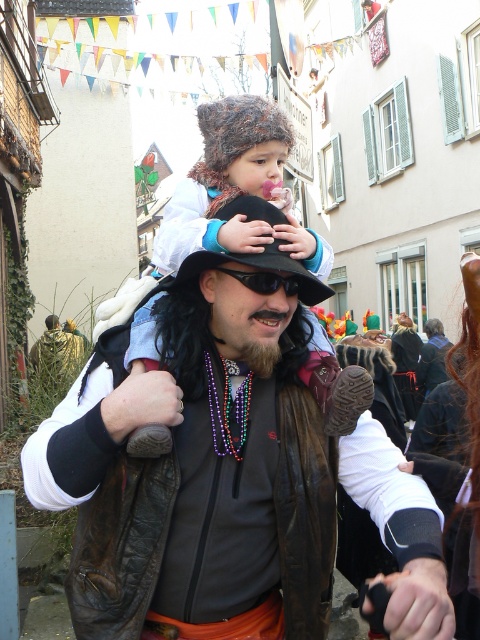
Question: Can you confirm if brown leather jacket at center is wider than black plastic goggles at center?

Choices:
 (A) no
 (B) yes

Answer: (B)

Question: Which point is farther to the camera?

Choices:
 (A) (216, 212)
 (B) (255, 547)
 (C) (203, 115)
 (D) (259, 292)

Answer: (C)

Question: Does fluffy brown hat at center appear on the right side of black felt hat at center?

Choices:
 (A) no
 (B) yes

Answer: (A)

Question: Which object is the closest to the black plastic goggles at center?

Choices:
 (A) brown leather jacket at center
 (B) fluffy brown hat at center
 (C) black felt hat at center

Answer: (C)

Question: Which object is farther from the camera taking this photo?

Choices:
 (A) black plastic goggles at center
 (B) fluffy brown hat at center

Answer: (A)

Question: Can you confirm if black felt hat at center is positioned to the right of black plastic goggles at center?

Choices:
 (A) yes
 (B) no

Answer: (B)